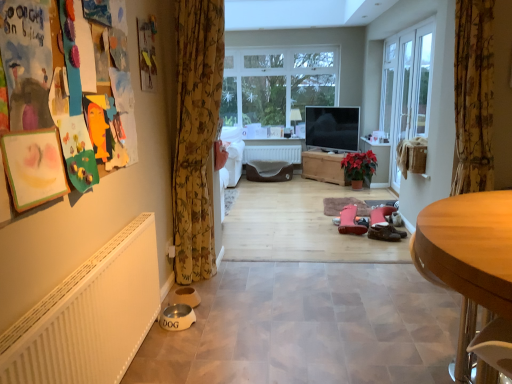
At what (x,y) coordinates should I click in order to perform the action: click on clear glass window at center. Please return your answer as a coordinate pair (x, y). Looking at the image, I should click on (276, 87).

What do you see at coordinates (402, 101) in the screenshot?
I see `white glass screen door at right` at bounding box center [402, 101].

You are a GUI agent. You are given a task and a screenshot of the screen. Output one action in this format:
    pyautogui.click(x=<x>, y=<y>)
    Task: Click on the white glass screen door at right
    The image size is (512, 384).
    Given the screenshot: What is the action you would take?
    pyautogui.click(x=402, y=101)

The width and height of the screenshot is (512, 384). What do you see at coordinates (359, 165) in the screenshot?
I see `red matte poinsettia at center` at bounding box center [359, 165].

At what (x,y) coordinates should I click in order to perform the action: click on red matte poinsettia at center. Please return your answer as a coordinate pair (x, y). Looking at the image, I should click on (359, 165).

This screenshot has height=384, width=512. What do you see at coordinates (295, 117) in the screenshot?
I see `white plastic lampshade at center` at bounding box center [295, 117].

What do you see at coordinates (471, 266) in the screenshot?
I see `wooden desk at lower right` at bounding box center [471, 266].

The width and height of the screenshot is (512, 384). Identify the location of brown leather boots at center, which is the first footwear in front-to-back order. (385, 232).

Measure the distance between pink suede boots at center, the 2th footwear in the front-to-back sequence, and brown leather boots at center, the 2th footwear from the back.

pink suede boots at center, the 2th footwear in the front-to-back sequence, and brown leather boots at center, the 2th footwear from the back, are 8.50 inches apart from each other.

Considering the sizes of pink suede boots at center, the first footwear from the back, and brown leather boots at center, the 2th footwear from the back, in the image, is pink suede boots at center, the first footwear from the back, wider or thinner than brown leather boots at center, the 2th footwear from the back,?

In the image, pink suede boots at center, the first footwear from the back, appears to be wider than brown leather boots at center, the 2th footwear from the back.

Is pink suede boots at center, the 2th footwear in the front-to-back sequence, at the right side of brown leather boots at center, which is the first footwear in front-to-back order?

No, pink suede boots at center, the 2th footwear in the front-to-back sequence, is not to the right of brown leather boots at center, which is the first footwear in front-to-back order.

Is point (342, 210) closer to viewer compared to point (383, 226)?

No, (342, 210) is further to viewer.

Which is closer to the camera, (x=361, y=172) or (x=481, y=92)?

Point (x=361, y=172) appears to be farther away from the viewer than point (x=481, y=92).

Considering the positions of objects red matte poinsettia at center and floral fabric curtain at right, positioned as the second curtain in left-to-right order, in the image provided, who is more to the right, red matte poinsettia at center or floral fabric curtain at right, positioned as the second curtain in left-to-right order,?

floral fabric curtain at right, positioned as the second curtain in left-to-right order, is more to the right.

Based on the photo, considering the positions of objects red matte poinsettia at center and floral fabric curtain at right, the 1th curtain positioned from the right, in the image provided, who is in front, red matte poinsettia at center or floral fabric curtain at right, the 1th curtain positioned from the right,?

floral fabric curtain at right, the 1th curtain positioned from the right, is more forward.

Considering the sizes of objects wooden desk at lower right and wooden chest at center in the image provided, who is taller, wooden desk at lower right or wooden chest at center?

With more height is wooden desk at lower right.

Can you confirm if wooden desk at lower right is positioned to the right of wooden chest at center?

No, wooden desk at lower right is not to the right of wooden chest at center.

Would you say wooden desk at lower right is inside or outside wooden chest at center?

The correct answer is: outside.

Could you tell me if wooden desk at lower right is facing wooden chest at center?

No, wooden desk at lower right is not oriented towards wooden chest at center.

How much distance is there between white matte radiator at center and pink suede boots at center, the first footwear from the back?

white matte radiator at center and pink suede boots at center, the first footwear from the back, are 2.53 meters apart.

In terms of size, does white matte radiator at center appear bigger or smaller than pink suede boots at center, the 2th footwear in the front-to-back sequence?

white matte radiator at center is smaller than pink suede boots at center, the 2th footwear in the front-to-back sequence.

Does point (289, 157) lie behind point (354, 219)?

Yes, point (289, 157) is behind point (354, 219).

Is white matte radiator at center looking in the opposite direction of wooden chest at center?

No.

Can you confirm if white matte radiator at center is thinner than wooden chest at center?

Indeed, white matte radiator at center has a lesser width compared to wooden chest at center.

Considering the sizes of objects white matte radiator at center and wooden chest at center in the image provided, who is shorter, white matte radiator at center or wooden chest at center?

white matte radiator at center.

Between point (251, 150) and point (308, 178), which one is positioned in front?

Point (251, 150)

Is floral fabric curtain at left, arranged as the second curtain when viewed from the right, further to the viewer compared to clear glass window at center?

No, floral fabric curtain at left, arranged as the second curtain when viewed from the right, is closer to the camera.

Is floral fabric curtain at left, which appears as the 1th curtain when viewed from the left, looking in the opposite direction of clear glass window at center?

Yes, floral fabric curtain at left, which appears as the 1th curtain when viewed from the left, is positioned with its back facing clear glass window at center.

Considering the sizes of objects floral fabric curtain at left, which appears as the 1th curtain when viewed from the left, and clear glass window at center in the image provided, who is shorter, floral fabric curtain at left, which appears as the 1th curtain when viewed from the left, or clear glass window at center?

→ clear glass window at center is shorter.

From the image's perspective, which is below, floral fabric curtain at left, arranged as the second curtain when viewed from the right, or clear glass window at center?

floral fabric curtain at left, arranged as the second curtain when viewed from the right, from the image's perspective.

Is floral fabric curtain at left, arranged as the second curtain when viewed from the right, situated inside wooden desk at lower right or outside?

floral fabric curtain at left, arranged as the second curtain when viewed from the right, is spatially situated outside wooden desk at lower right.

From the image's perspective, relative to wooden desk at lower right, is floral fabric curtain at left, arranged as the second curtain when viewed from the right, above or below?

Based on their image positions, floral fabric curtain at left, arranged as the second curtain when viewed from the right, is located above wooden desk at lower right.

Is floral fabric curtain at left, arranged as the second curtain when viewed from the right, touching wooden desk at lower right?

floral fabric curtain at left, arranged as the second curtain when viewed from the right, and wooden desk at lower right are not in contact.

Locate an element on the screen. Image resolution: width=512 pixels, height=384 pixels. footwear above the brown leather boots at center, which is the first footwear in front-to-back order (from the image's perspective) is located at coordinates (350, 221).

Identify the location of curtain on the right side of red matte poinsettia at center. (473, 96).

Based on their spatial positions, is pink suede boots at center, the 2th footwear in the front-to-back sequence, or red matte poinsettia at center further from wooden desk at lower right?

red matte poinsettia at center.

Looking at the image, which one is located closer to wooden chest at center, floral fabric curtain at left, which appears as the 1th curtain when viewed from the left, or white glass screen door at right?

white glass screen door at right is positioned closer to the anchor wooden chest at center.

Which object lies nearer to the anchor point white matte radiator at center, white plastic lampshade at center or pink suede boots at center, the first footwear from the back?

The object closer to white matte radiator at center is white plastic lampshade at center.

Estimate the real-world distances between objects in this image. Which object is closer to wooden desk at lower right, red matte poinsettia at center or floral fabric curtain at right, positioned as the second curtain in left-to-right order?

floral fabric curtain at right, positioned as the second curtain in left-to-right order, lies closer to wooden desk at lower right than the other object.

Looking at the image, which one is located closer to brown leather boots at center, the 2th footwear from the back, floral fabric curtain at right, the 1th curtain positioned from the right, or white matte radiator at center?

floral fabric curtain at right, the 1th curtain positioned from the right, is positioned closer to the anchor brown leather boots at center, the 2th footwear from the back.

Estimate the real-world distances between objects in this image. Which object is closer to clear glass window at center, white plastic lampshade at center or red matte poinsettia at center?

Based on the image, white plastic lampshade at center appears to be nearer to clear glass window at center.

Estimate the real-world distances between objects in this image. Which object is closer to white plastic lampshade at center, white matte radiator at center or wooden chest at center?

white matte radiator at center is positioned closer to the anchor white plastic lampshade at center.

When comparing their distances from white matte radiator at center, does floral fabric curtain at left, which appears as the 1th curtain when viewed from the left, or red matte poinsettia at center seem closer?

red matte poinsettia at center is positioned closer to the anchor white matte radiator at center.

Where is `curtain between floral fabric curtain at right, the 1th curtain positioned from the right, and red matte poinsettia at center from front to back`? The image size is (512, 384). curtain between floral fabric curtain at right, the 1th curtain positioned from the right, and red matte poinsettia at center from front to back is located at coordinates (196, 135).

You are a GUI agent. You are given a task and a screenshot of the screen. Output one action in this format:
    pyautogui.click(x=<x>, y=<y>)
    Task: Click on the cabinetry located between floral fabric curtain at left, arranged as the second curtain when viewed from the right, and white matte radiator at center in the depth direction
    This screenshot has width=512, height=384.
    Given the screenshot: What is the action you would take?
    pyautogui.click(x=323, y=167)

Where is `window between red matte poinsettia at center and white matte radiator at center from front to back`? window between red matte poinsettia at center and white matte radiator at center from front to back is located at coordinates (276, 87).

Locate an element on the screen. The height and width of the screenshot is (384, 512). window between wooden desk at lower right and white matte radiator at center from front to back is located at coordinates click(276, 87).